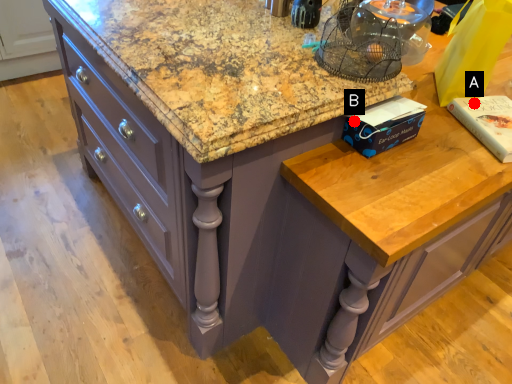
Question: Two points are circled on the image, labeled by A and B beside each circle. Which point is closer to the camera?

Choices:
 (A) A is closer
 (B) B is closer

Answer: (B)